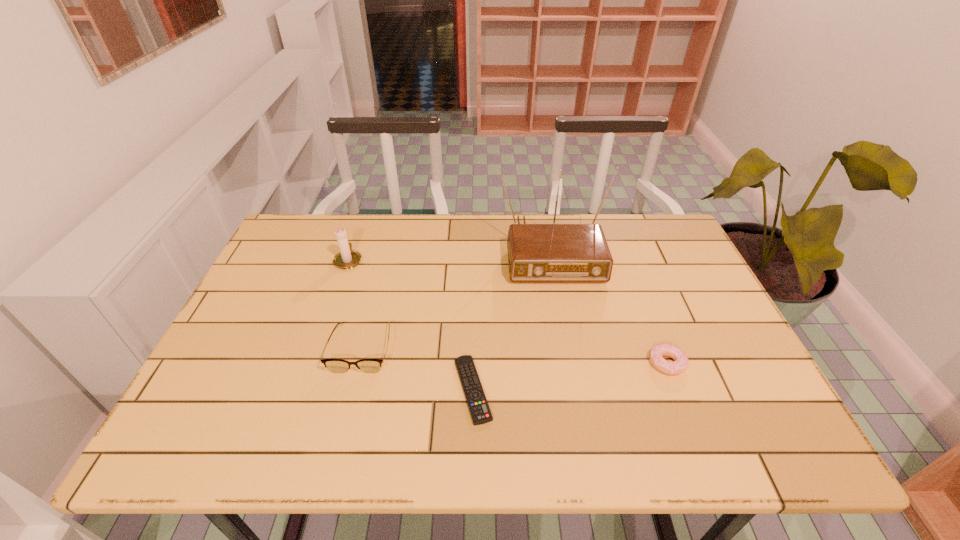
Where is `radio_receiver`? radio_receiver is located at coordinates (537, 253).

Where is `the tallest object`? the tallest object is located at coordinates (537, 253).

I want to click on candle holder, so click(347, 258).

Identify the location of spectacles. The image size is (960, 540). (334, 365).

The image size is (960, 540). Find the location of `the rightmost object`. the rightmost object is located at coordinates (680, 363).

At what (x,y) coordinates should I click in order to perform the action: click on doughnut. Please return your answer as a coordinate pair (x, y). This screenshot has width=960, height=540. Looking at the image, I should click on (680, 363).

The width and height of the screenshot is (960, 540). Identify the location of the third object from right to left. (477, 403).

Identify the location of the shortest object. The image size is (960, 540). (477, 403).

Identify the location of vacant space situated on the front panel of the fourth object from left to right. (564, 326).

You are a GUI agent. You are given a task and a screenshot of the screen. Output one action in this format:
    pyautogui.click(x=<x>, y=<y>)
    Task: Click on the free space located 0.060m on the handle side of the second tallest object
    Image resolution: width=960 pixels, height=540 pixels.
    Given the screenshot: What is the action you would take?
    pyautogui.click(x=356, y=238)